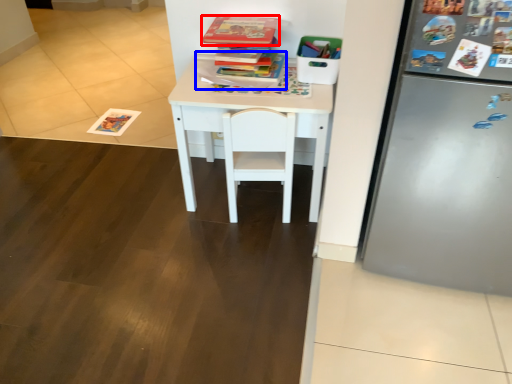
Question: Which object appears farthest to the camera in this image, book (highlighted by a red box) or book (highlighted by a blue box)?

Choices:
 (A) book
 (B) book

Answer: (B)